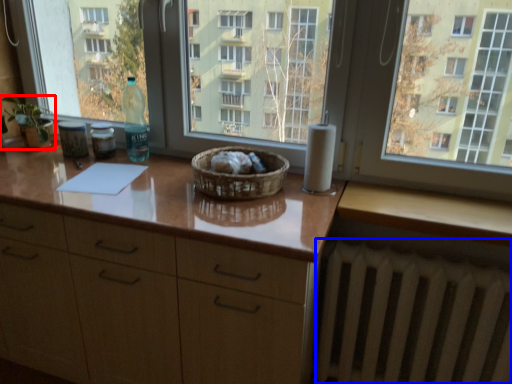
Question: Which object is further to the camera taking this photo, houseplant (highlighted by a red box) or radiator (highlighted by a blue box)?

Choices:
 (A) houseplant
 (B) radiator

Answer: (A)